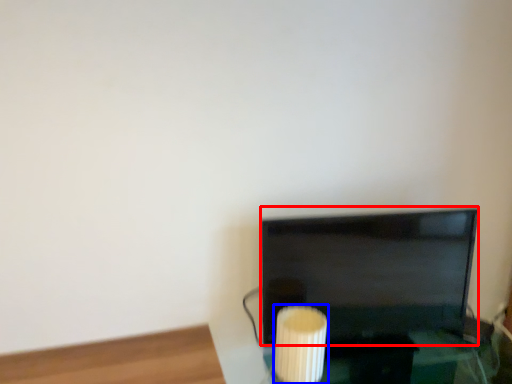
Question: Which object is further to the camera taking this photo, television (highlighted by a red box) or candle holder (highlighted by a blue box)?

Choices:
 (A) television
 (B) candle holder

Answer: (A)